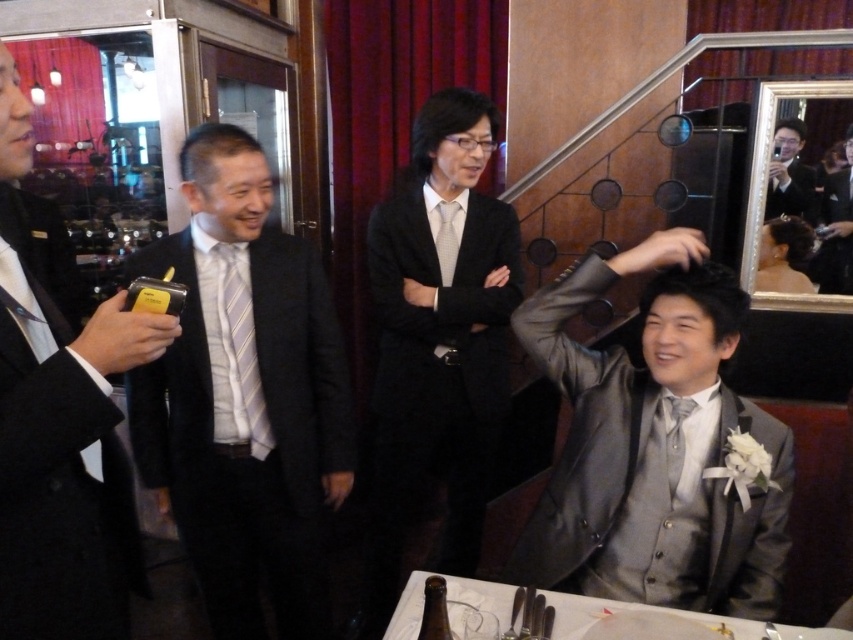
Question: Which of the following is the closest to the observer?

Choices:
 (A) dark gray suit at left
 (B) black glossy suit at center
 (C) white paper at lower center
 (D) striped silk tie at center

Answer: (C)

Question: Is shiny black suit at upper right further to camera compared to matte gray tie at center?

Choices:
 (A) yes
 (B) no

Answer: (A)

Question: Which object appears farthest from the camera in this image?

Choices:
 (A) shiny black suit at upper right
 (B) striped silk tie at center

Answer: (A)

Question: Does dark gray suit at left appear on the right side of matte gray tie at center?

Choices:
 (A) no
 (B) yes

Answer: (A)

Question: Which of the following is the closest to the observer?

Choices:
 (A) black suit at left
 (B) striped silk tie at center
 (C) white paper at lower center
 (D) dark gray suit at left

Answer: (A)

Question: Can you confirm if satin silver suit at center is thinner than striped silk tie at center?

Choices:
 (A) no
 (B) yes

Answer: (A)